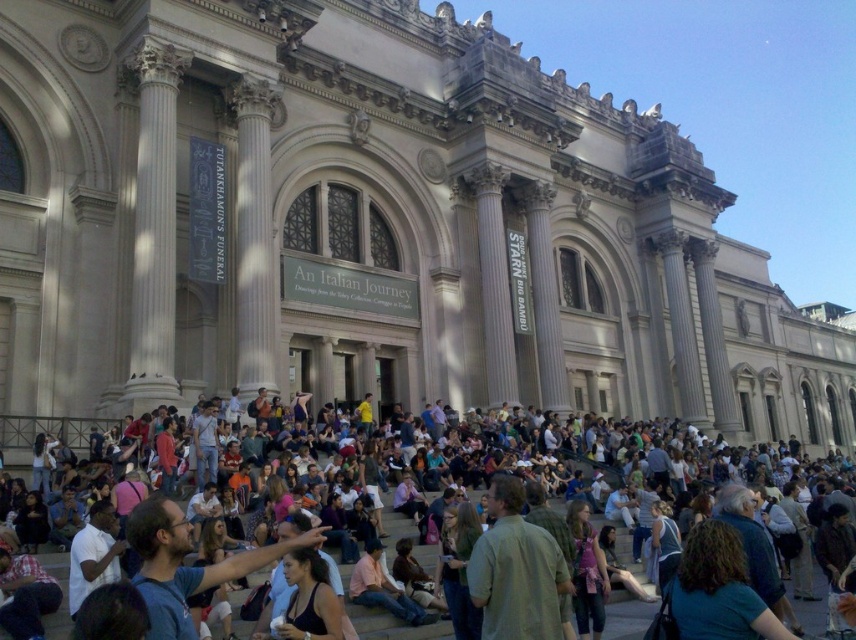
Question: Which is farther from the green fabric jacket at center?

Choices:
 (A) multicolored casual attire at center
 (B) dark blue shirt at lower right

Answer: (A)

Question: Which of the following is the farthest from the observer?

Choices:
 (A) (476, 628)
 (B) (340, 532)
 (C) (703, 620)

Answer: (B)

Question: From the image, what is the correct spatial relationship of multicolored casual attire at center in relation to green textured jacket at center?

Choices:
 (A) right
 (B) left

Answer: (A)

Question: Based on their relative distances, which object is nearer to the multicolored casual attire at center?

Choices:
 (A) green fabric jacket at center
 (B) green textured jacket at center
 (C) dark blue shirt at lower right

Answer: (B)

Question: Considering the relative positions of dark blue shirt at lower right and green textured jacket at center in the image provided, where is dark blue shirt at lower right located with respect to green textured jacket at center?

Choices:
 (A) above
 (B) below

Answer: (A)

Question: Can you confirm if multicolored casual attire at center is smaller than green fabric jacket at center?

Choices:
 (A) no
 (B) yes

Answer: (A)